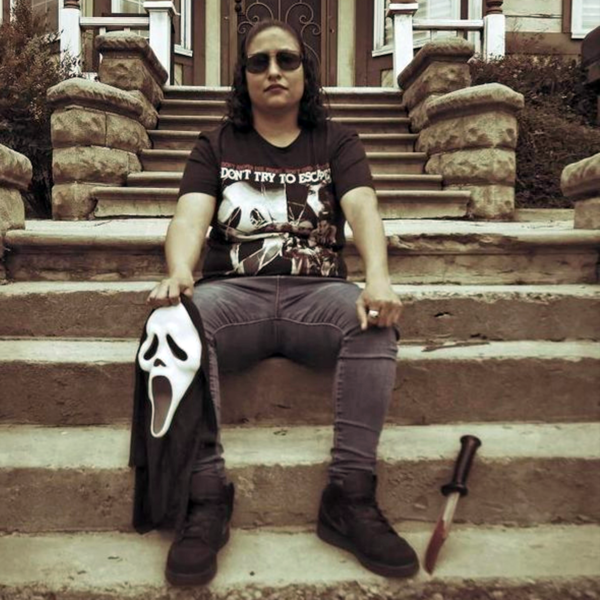
Where is `handle`? This screenshot has width=600, height=600. handle is located at coordinates (455, 484).